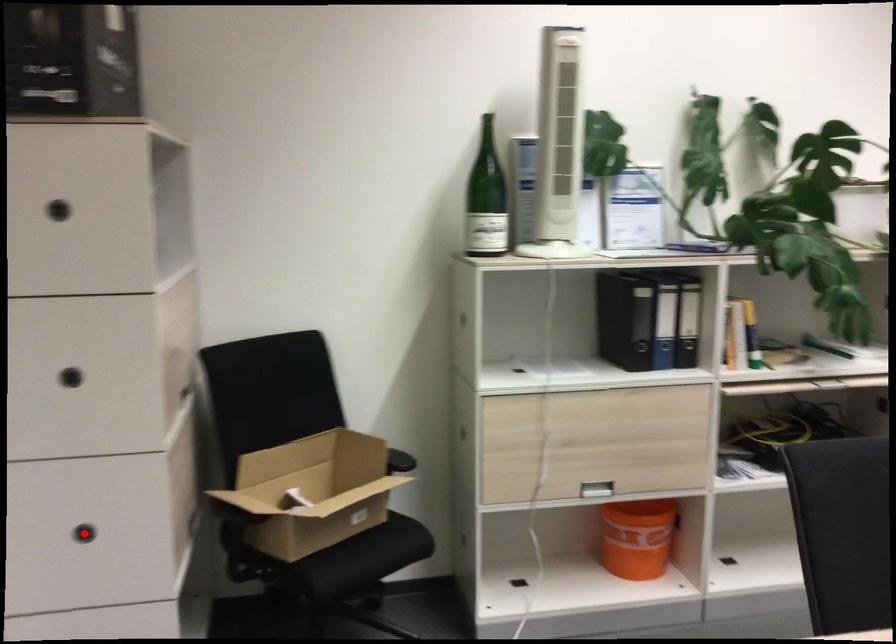
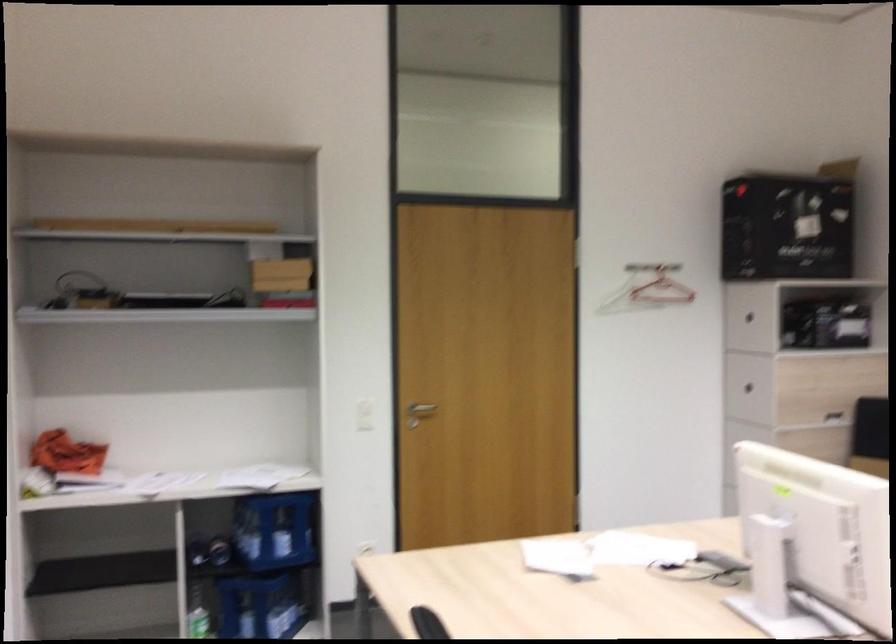
Question: I am providing you with two images of the same scene from different viewpoints. A red point is marked on the first image. At the location where the point appears in image 1, is it still visible in image 2?

Choices:
 (A) Yes
 (B) No

Answer: (B)